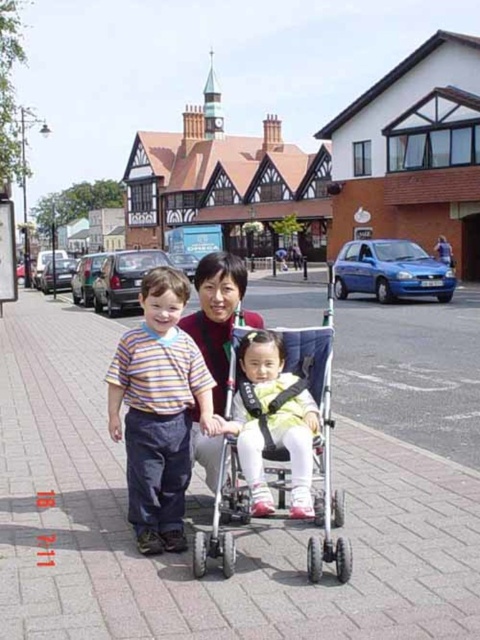
You are walking on the brick pavement at center and see a striped cotton shirt at left. Which object is located to the left of the other?

The brick pavement at center is positioned on the left side of striped cotton shirt at left, so the brick pavement at center is to the left of the striped cotton shirt at left.

From the picture: You are a photographer standing on the sidewalk and want to take a photo of the light blue fabric stroller at center and the light yellow fabric dress at center. Which object will appear taller in the photo?

The light blue fabric stroller at center will appear taller in the photo because it has a greater height compared to the light yellow fabric dress at center.

In the scene shown: You are standing on the sidewalk in the image and want to walk from point A to point B. Point A is at coordinates point (399, 568) and point B is at coordinates point (157, 433). Which point should you start walking from to reach the other point without going backward?

You should start walking from point A at coordinates point (399, 568) because it is closer to the viewer than point B at coordinates point (157, 433), so moving forward from point A will lead you toward point B.